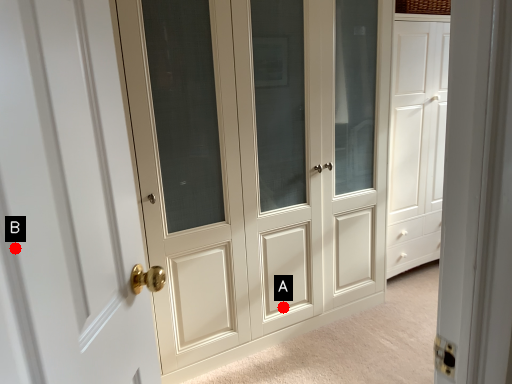
Question: Two points are circled on the image, labeled by A and B beside each circle. Which point is farther to the camera?

Choices:
 (A) A is further
 (B) B is further

Answer: (A)